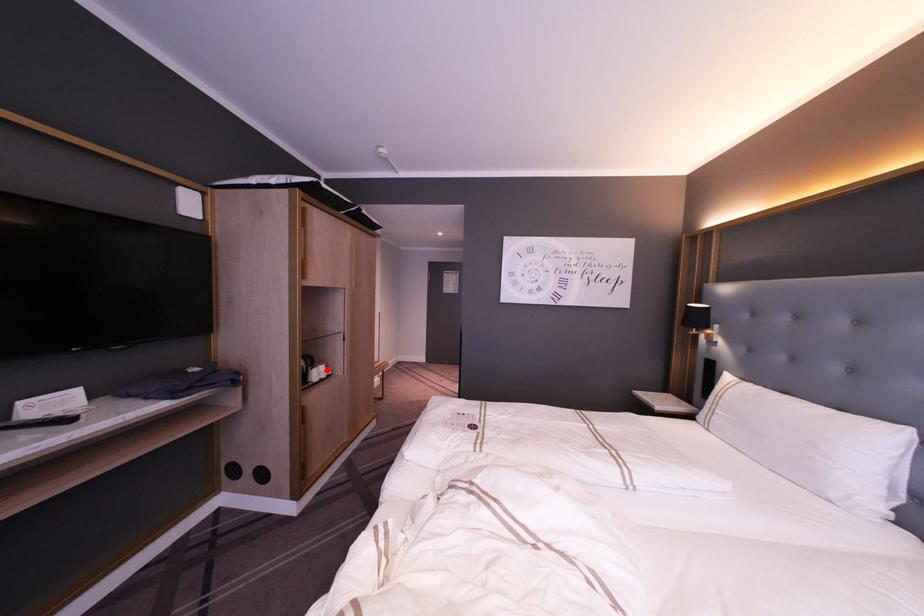
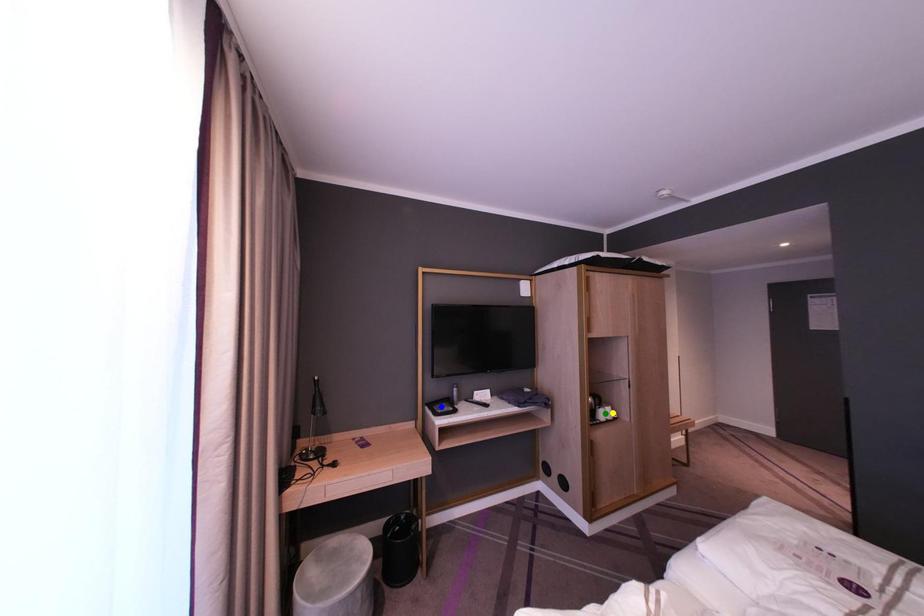
Question: I am providing you with two images of the same scene from different viewpoints. A red point is marked on the first image. You are given multiple points on the second image. Can you choose the point in image 2 that corresponds to the point in image 1?

Choices:
 (A) green point
 (B) blue point
 (C) yellow point

Answer: (C)